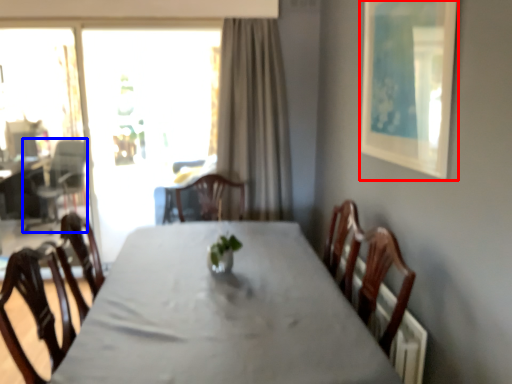
Question: Among these objects, which one is nearest to the camera, picture frame (highlighted by a red box) or armchair (highlighted by a blue box)?

Choices:
 (A) picture frame
 (B) armchair

Answer: (A)